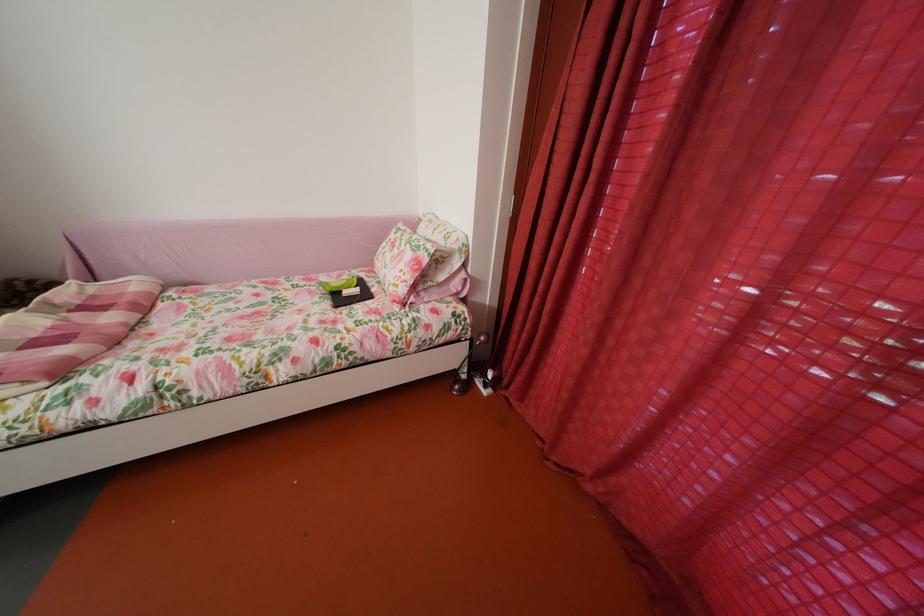
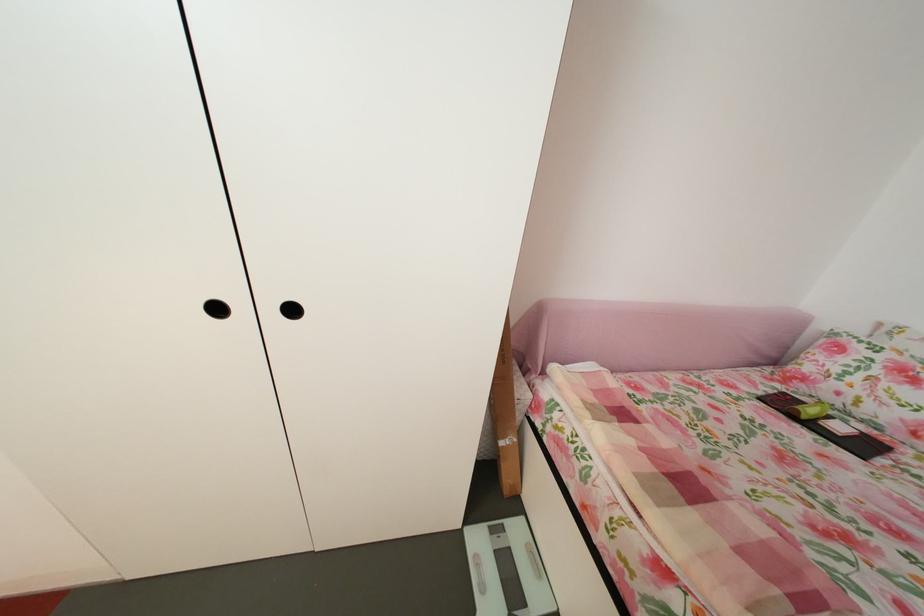
Question: Which direction would the cameraman need to move to produce the second image? Reply with the corresponding letter.

Choices:
 (A) Left
 (B) Right
 (C) Forward
 (D) Backward

Answer: (A)